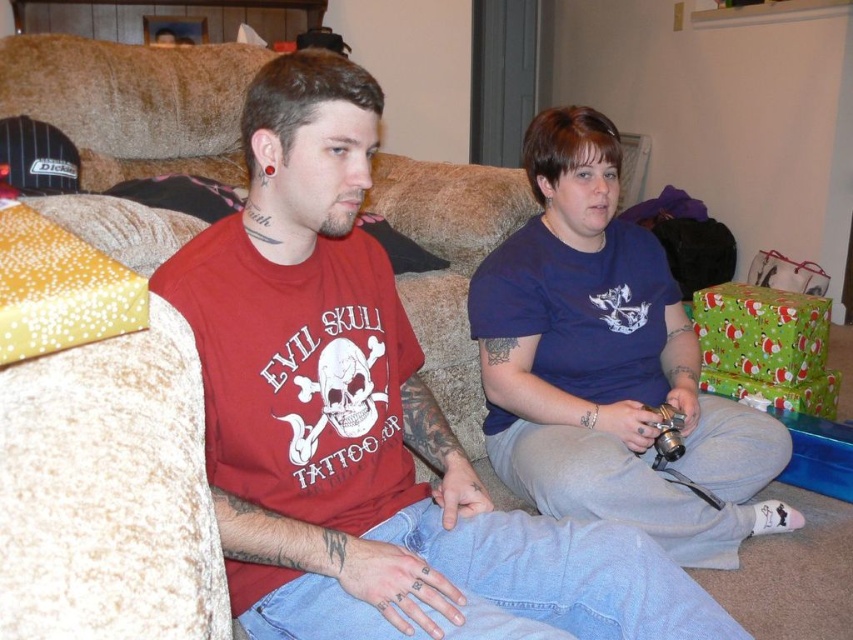
Question: Is red matte t-shirt at center thinner than metallic silver game controller at lower center?

Choices:
 (A) no
 (B) yes

Answer: (A)

Question: Is blue cotton shirt at center in front of metallic silver game controller at lower center?

Choices:
 (A) no
 (B) yes

Answer: (B)

Question: Which of the following is the farthest from the observer?

Choices:
 (A) (654, 442)
 (B) (351, 211)
 (C) (567, 172)

Answer: (A)

Question: Is blue cotton shirt at center closer to camera compared to metallic silver game controller at lower center?

Choices:
 (A) no
 (B) yes

Answer: (B)

Question: Which of the following is the closest to the observer?

Choices:
 (A) (283, 128)
 (B) (560, 332)

Answer: (A)

Question: Which point is closer to the camera?

Choices:
 (A) metallic silver game controller at lower center
 (B) red matte t-shirt at center
 (C) blue cotton shirt at center

Answer: (B)